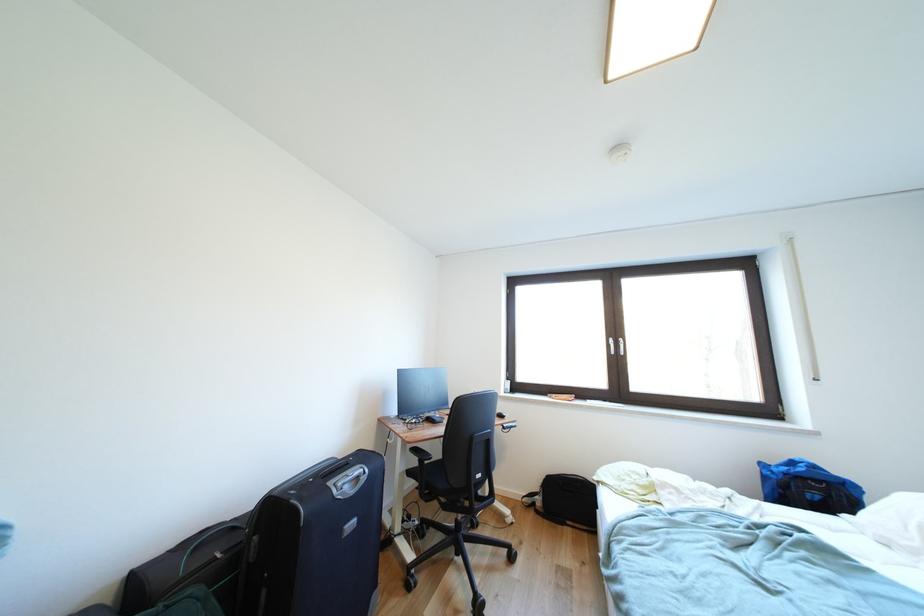
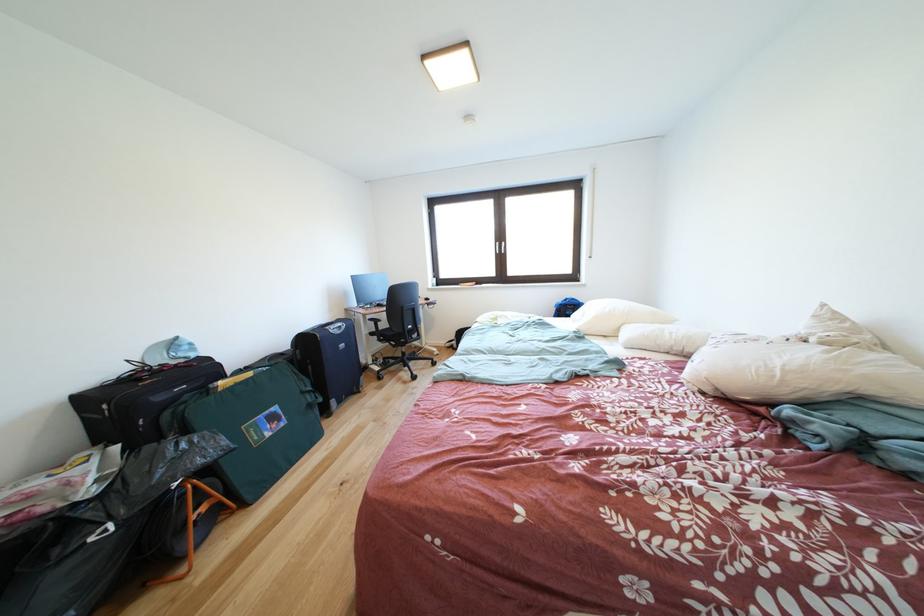
Locate, in the second image, the point that corresponds to pixel 825 485 in the first image.

(578, 310)